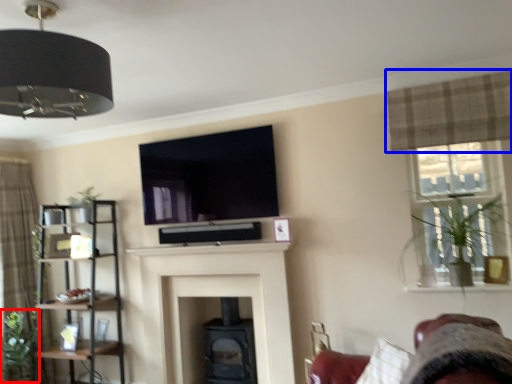
Question: Which object appears farthest to the camera in this image, plant (highlighted by a red box) or curtain (highlighted by a blue box)?

Choices:
 (A) plant
 (B) curtain

Answer: (A)